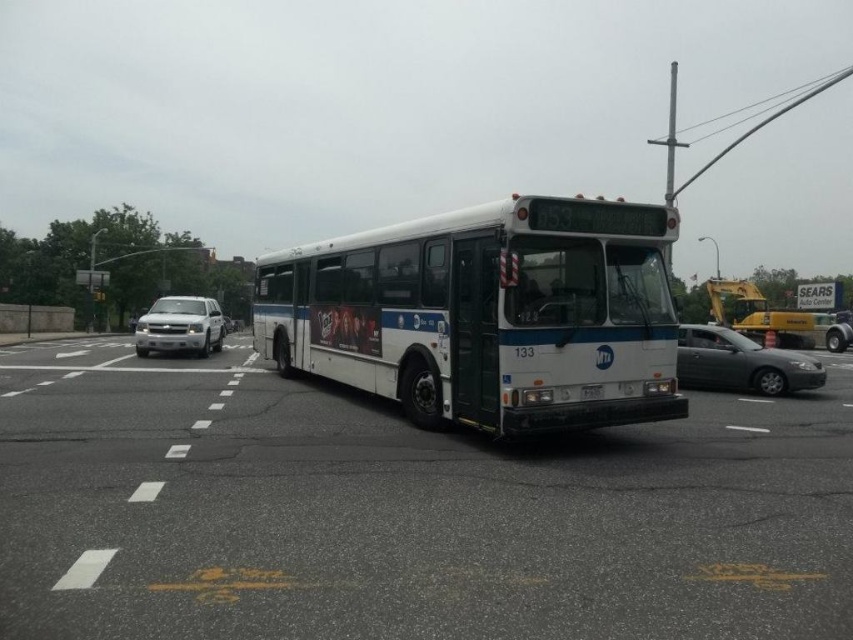
Question: Can you confirm if white metallic bus at center is positioned to the right of white plastic license plate at center?

Choices:
 (A) no
 (B) yes

Answer: (A)

Question: Which point is closer to the camera taking this photo?

Choices:
 (A) (751, 381)
 (B) (137, 326)
 (C) (589, 394)

Answer: (C)

Question: Which object is the closest to the satin silver sedan at right?

Choices:
 (A) white metallic bus at center
 (B) silver metallic truck at left
 (C) white plastic license plate at center

Answer: (C)

Question: Can you confirm if white metallic bus at center is positioned to the right of white plastic license plate at center?

Choices:
 (A) yes
 (B) no

Answer: (B)

Question: Which object appears closest to the camera in this image?

Choices:
 (A) satin silver sedan at right
 (B) silver metallic truck at left
 (C) white metallic bus at center

Answer: (C)

Question: Does satin silver sedan at right appear over white plastic license plate at center?

Choices:
 (A) yes
 (B) no

Answer: (B)